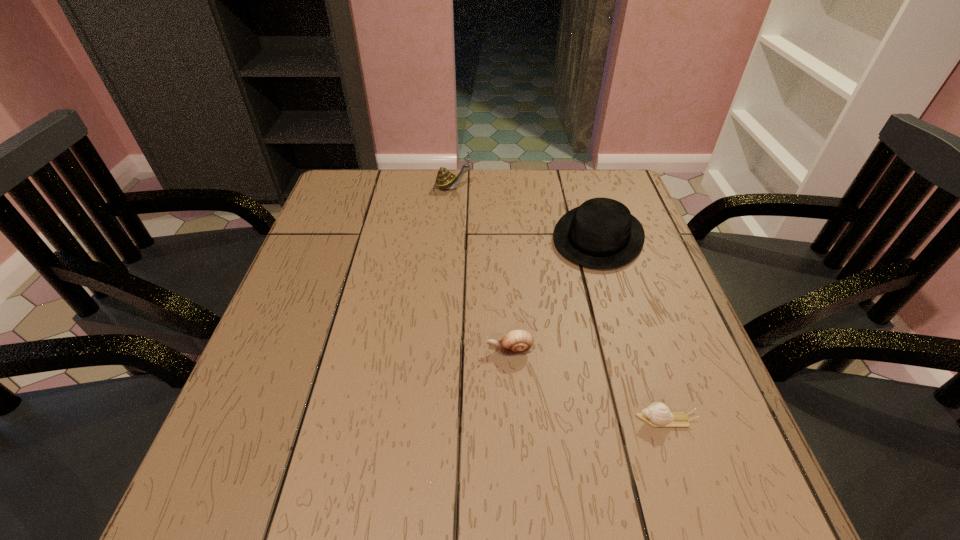
Where is `free region located on the front-facing side of the second nearest escargot`? The image size is (960, 540). free region located on the front-facing side of the second nearest escargot is located at coordinates (329, 350).

Where is `blank space located 0.380m on the front-facing side of the second nearest escargot`? Image resolution: width=960 pixels, height=540 pixels. blank space located 0.380m on the front-facing side of the second nearest escargot is located at coordinates (300, 350).

I want to click on free region located 0.240m on the front-facing side of the second nearest escargot, so click(369, 350).

Identify the location of vacant region located on the shell of the shortest object. This screenshot has height=540, width=960. (420, 420).

The width and height of the screenshot is (960, 540). In order to click on vacant area situated on the shell of the shortest object in this screenshot , I will do `click(425, 420)`.

Image resolution: width=960 pixels, height=540 pixels. Identify the location of free spot located 0.170m on the shell of the shortest object. (542, 420).

At what (x,y) coordinates should I click in order to perform the action: click on snail that is at the far edge. Please return your answer as a coordinate pair (x, y). Looking at the image, I should click on (445, 180).

The width and height of the screenshot is (960, 540). What are the coordinates of `fedora that is positioned at the far edge` in the screenshot? It's located at (601, 233).

In order to click on fedora that is at the right edge in this screenshot , I will do `click(601, 233)`.

You are a GUI agent. You are given a task and a screenshot of the screen. Output one action in this format:
    pyautogui.click(x=<x>, y=<y>)
    Task: Click on the escargot that is at the right edge
    
    Given the screenshot: What is the action you would take?
    pyautogui.click(x=657, y=414)